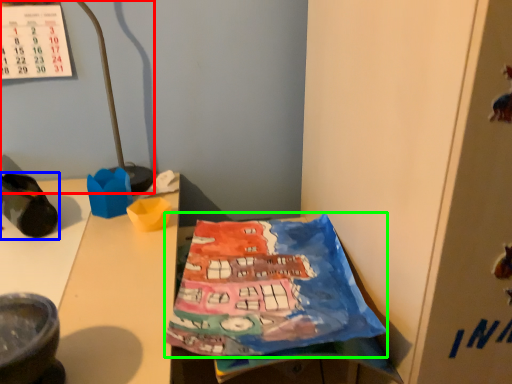
Question: Based on their relative distances, which object is farther from lamp (highlighted by a red box)? Choose from footwear (highlighted by a blue box) and wrapping paper (highlighted by a green box).

Choices:
 (A) footwear
 (B) wrapping paper

Answer: (B)